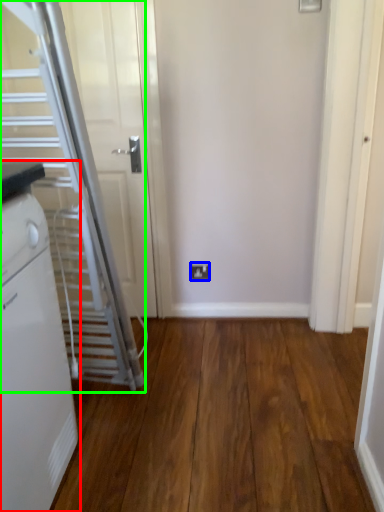
Question: Based on their relative distances, which object is nearer to home appliance (highlighted by a red box)? Choose from electric outlet (highlighted by a blue box) and escalator (highlighted by a green box).

Choices:
 (A) electric outlet
 (B) escalator

Answer: (B)